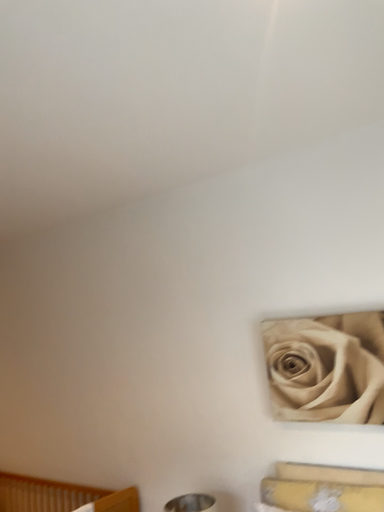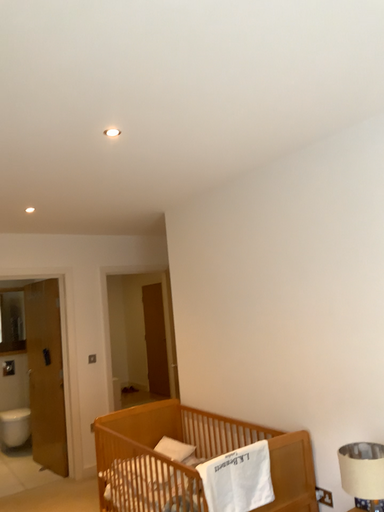
Question: Which way did the camera rotate in the video?

Choices:
 (A) rotated upward
 (B) rotated downward

Answer: (B)